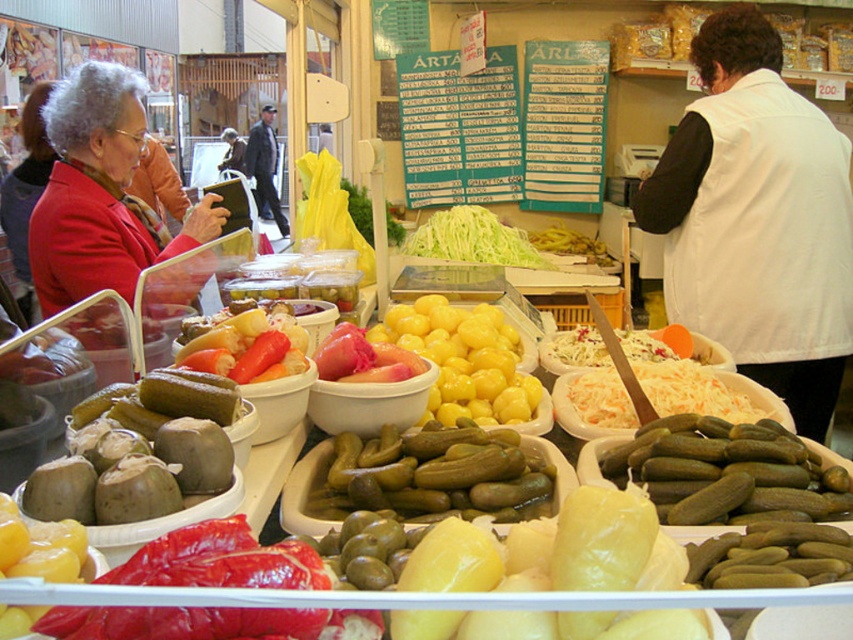
Question: Estimate the real-world distances between objects in this image. Which object is farther from the shiny red pepper at lower left?

Choices:
 (A) yellow glossy cherry tomatoes at center
 (B) yellow glossy pickles at center
 (C) white cotton vest at center
 (D) green pickles at center

Answer: (B)

Question: Which point is closer to the camera?

Choices:
 (A) yellow glossy cherry tomatoes at center
 (B) matte red jacket at upper left
 (C) green pickles at center
 (D) white cotton vest at center

Answer: (C)

Question: Which object appears closest to the camera in this image?

Choices:
 (A) shredded white cabbage at center
 (B) shiny red pepper at lower left
 (C) shredded green lettuce at center

Answer: (B)

Question: Is yellow glossy cherry tomatoes at center closer to the viewer compared to shredded white cabbage at center?

Choices:
 (A) yes
 (B) no

Answer: (A)

Question: Can you confirm if shiny red pepper at lower left is positioned above leather jacket at center?

Choices:
 (A) yes
 (B) no

Answer: (B)

Question: Considering the relative positions of shiny red pepper at lower left and leather jacket at center in the image provided, where is shiny red pepper at lower left located with respect to leather jacket at center?

Choices:
 (A) below
 (B) above

Answer: (A)